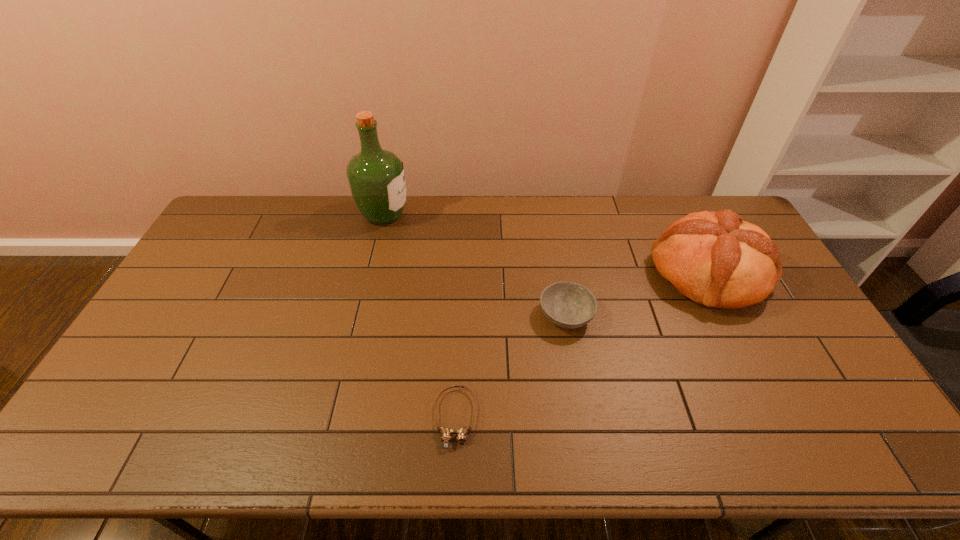
I want to click on vacant space situated 0.180m on the left of the bowl, so click(478, 315).

What are the coordinates of `liquor located in the far edge section of the desktop` in the screenshot? It's located at (376, 177).

At what (x,y) coordinates should I click in order to perform the action: click on bread that is at the far edge. Please return your answer as a coordinate pair (x, y). Looking at the image, I should click on (716, 259).

The width and height of the screenshot is (960, 540). I want to click on object that is at the near edge, so click(446, 433).

Where is `object that is at the right edge`? object that is at the right edge is located at coordinates click(716, 259).

This screenshot has width=960, height=540. In order to click on object present at the far right corner in this screenshot , I will do `click(716, 259)`.

Locate an element on the screen. free space at the far edge is located at coordinates (295, 224).

Find the location of a particular element. The height and width of the screenshot is (540, 960). free space at the near edge of the desktop is located at coordinates coord(690,429).

Find the location of `vacant space at the right edge of the desktop`. vacant space at the right edge of the desktop is located at coordinates (773, 364).

The height and width of the screenshot is (540, 960). What are the coordinates of `blank space at the near left corner` in the screenshot? It's located at pos(142,447).